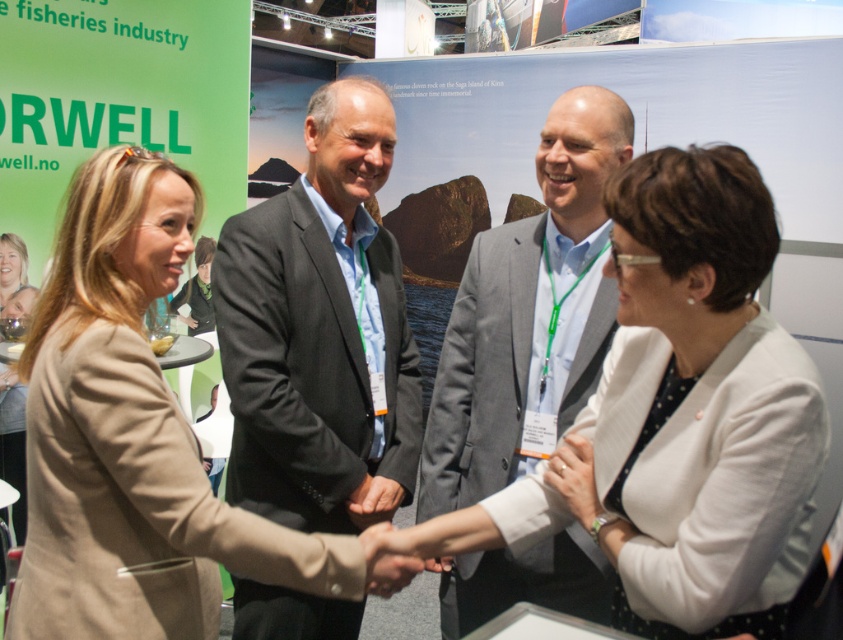
You are an event planner arranging a photo shoot at the conference venue. You need to ensure that the beige fabric coat at center and the white matte ring at center are visible in the photo. Based on their positions, which object is higher up in the frame?

The beige fabric coat at center is above the white matte ring at center, so it is higher up in the frame.

You are an event planner at the conference and need to arrange a photo shoot. You want to ensure that the gray suit at center is visible above the smooth skin hand at center in the photo. Is this possible based on their current positions?

The gray suit at center has a greater height compared to the smooth skin hand at center, so yes, the gray suit at center will naturally appear above the smooth skin hand at center in the photo.